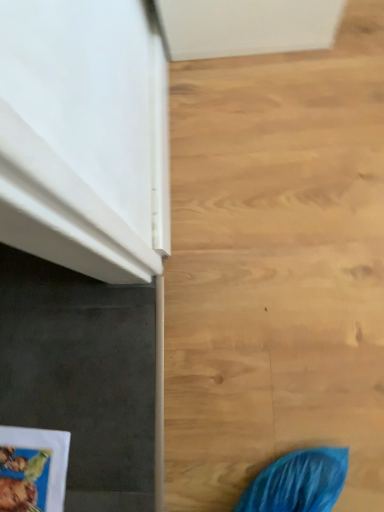
Describe the element at coordinates (32, 469) in the screenshot. I see `white glossy picture frame at lower left` at that location.

What are the coordinates of `white glossy picture frame at lower left` in the screenshot? It's located at (32, 469).

Identify the location of white glossy picture frame at lower left. This screenshot has height=512, width=384. (32, 469).